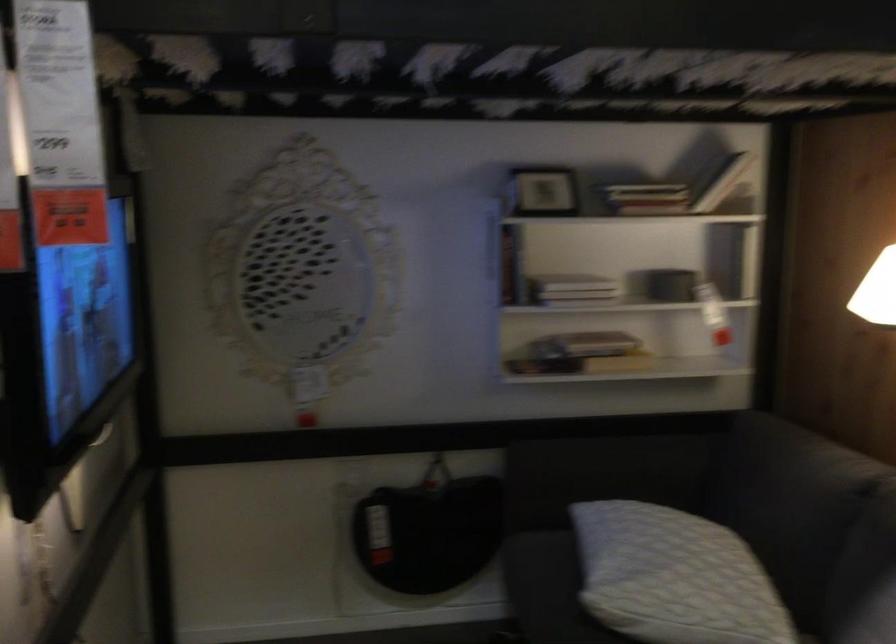
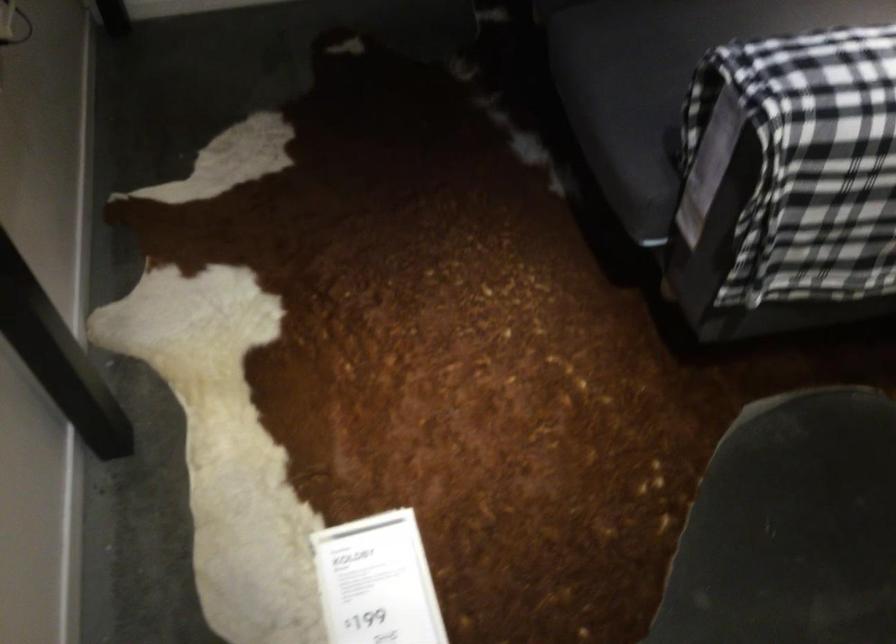
Question: The first image is from the beginning of the video and the second image is from the end. How did the camera likely rotate when shooting the video?

Choices:
 (A) Left
 (B) Right
 (C) Up
 (D) Down

Answer: (D)